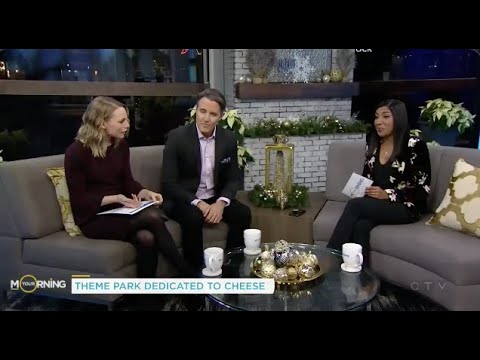
This screenshot has height=360, width=480. Find the location of `throw pillow`. throw pillow is located at coordinates (471, 204).